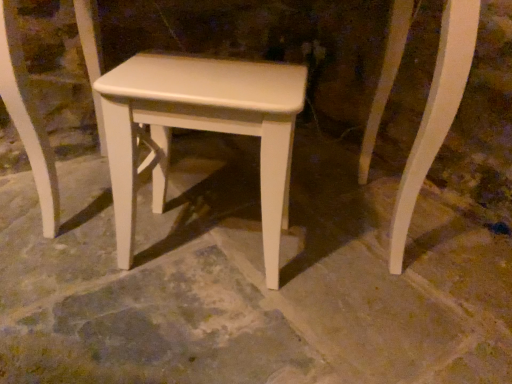
Question: From the image's perspective, is white matte stool at center located above or below white smooth concrete at center?

Choices:
 (A) above
 (B) below

Answer: (A)

Question: Is point (218, 120) closer or farther from the camera than point (167, 230)?

Choices:
 (A) farther
 (B) closer

Answer: (B)

Question: Considering their positions, is white matte stool at center located in front of or behind white smooth concrete at center?

Choices:
 (A) front
 (B) behind

Answer: (B)

Question: Based on their sizes in the image, would you say white smooth concrete at center is bigger or smaller than white matte stool at center?

Choices:
 (A) small
 (B) big

Answer: (B)

Question: Is white smooth concrete at center in front of or behind white matte stool at center in the image?

Choices:
 (A) front
 (B) behind

Answer: (A)

Question: From a real-world perspective, is white smooth concrete at center physically located above or below white matte stool at center?

Choices:
 (A) below
 (B) above

Answer: (A)

Question: In terms of height, does white smooth concrete at center look taller or shorter compared to white matte stool at center?

Choices:
 (A) tall
 (B) short

Answer: (B)